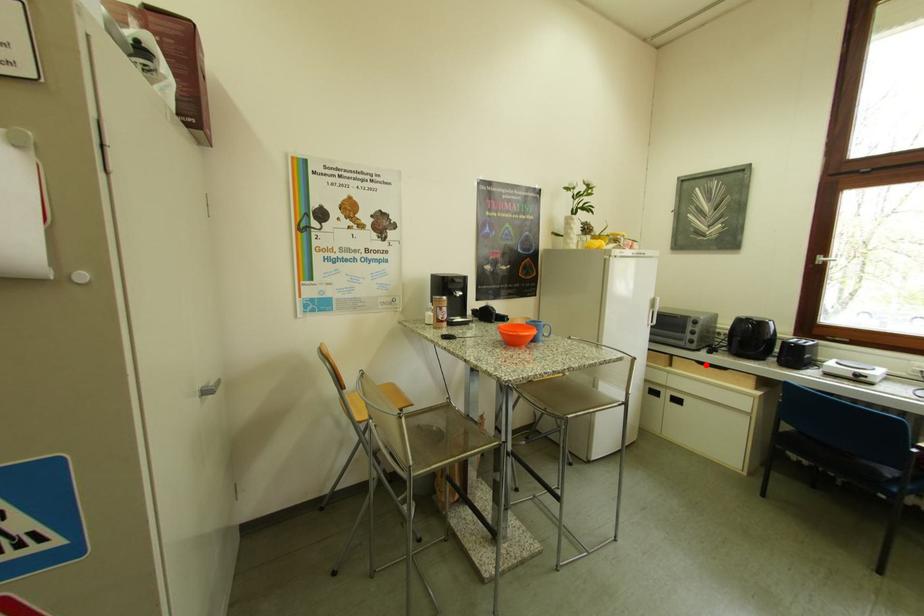
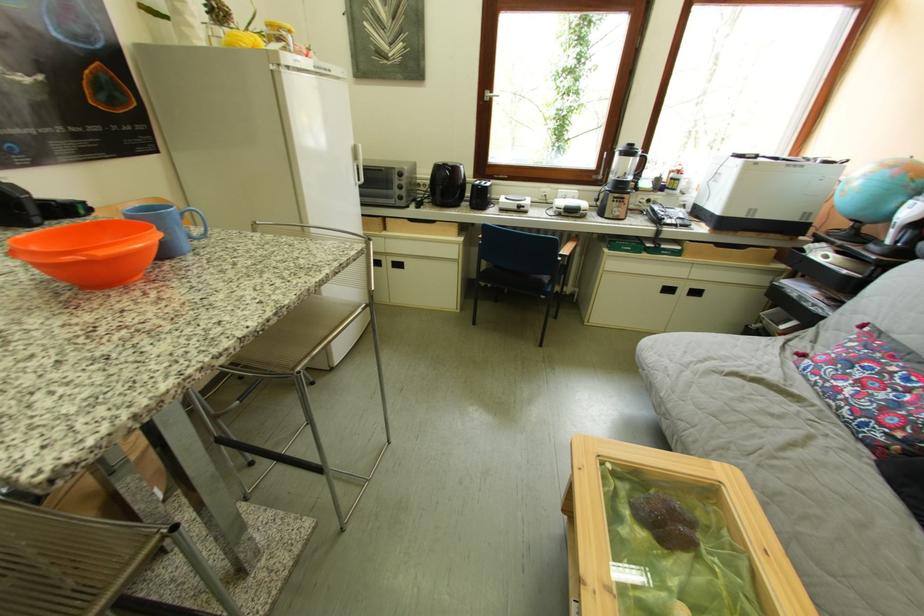
In the second image, find the point that corresponds to the highlighted location in the first image.

(419, 223)